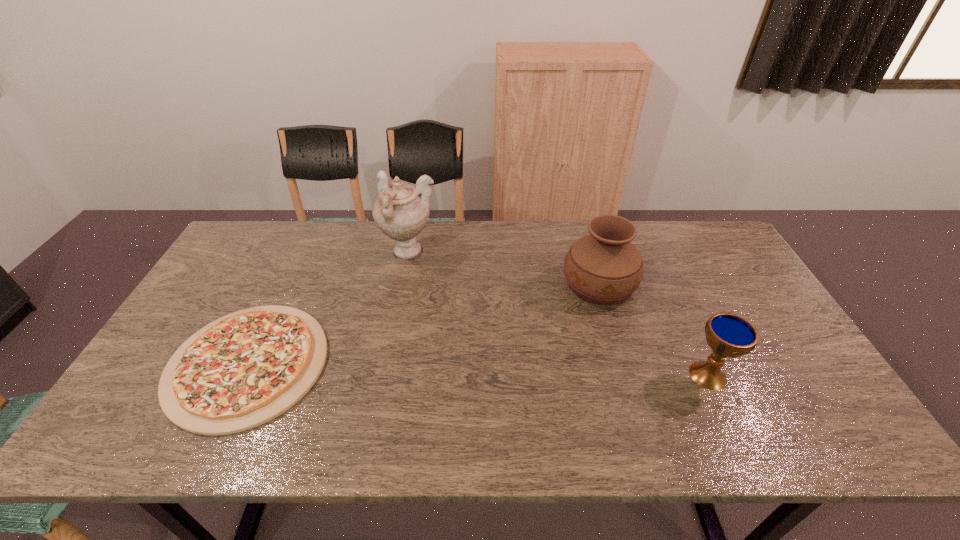
Where is `vacant space in between the rightmost object and the right urn`? Image resolution: width=960 pixels, height=540 pixels. vacant space in between the rightmost object and the right urn is located at coordinates (654, 329).

Identify the location of object that is the third closest one to the left urn. The width and height of the screenshot is (960, 540). (728, 335).

Identify which object is the second nearest to the second tallest object. Please provide its 2D coordinates. Your answer should be formatted as a tuple, i.e. [(x, y)], where the tuple contains the x and y coordinates of a point satisfying the conditions above.

[(401, 211)]

The image size is (960, 540). What are the coordinates of `vacant area in the image that satisfies the following two spatial constraints: 1. on the front side of the shorter urn; 2. on the right side of the third tallest object` in the screenshot? It's located at (626, 375).